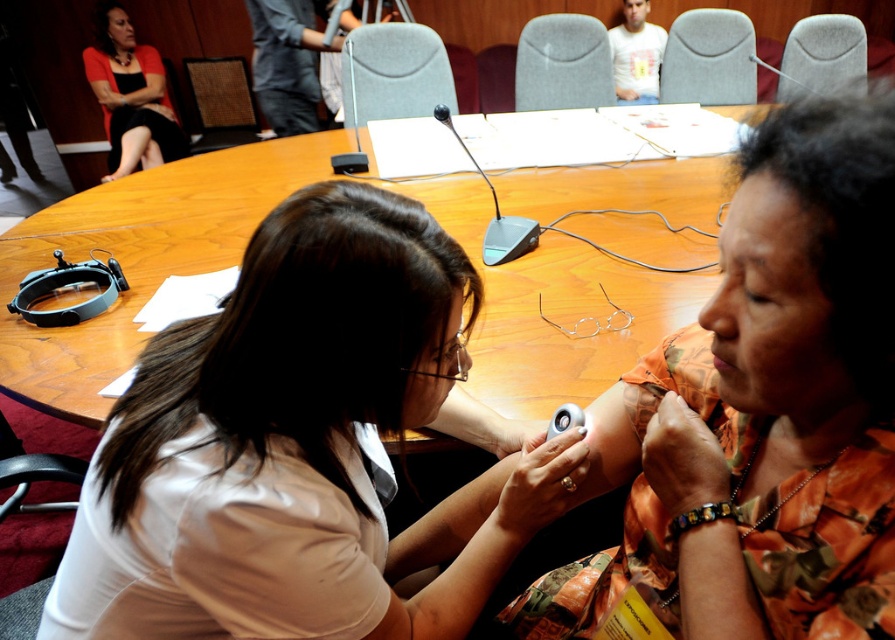
Question: Estimate the real-world distances between objects in this image. Which object is closer to the wooden at center?

Choices:
 (A) orange floral shirt at center
 (B) white matte shirt at center
 (C) matte black dress at upper left

Answer: (B)

Question: Is white matte shirt at center above orange floral shirt at center?

Choices:
 (A) yes
 (B) no

Answer: (B)

Question: Where is wooden at center located in relation to matte black dress at upper left in the image?

Choices:
 (A) right
 (B) left

Answer: (A)

Question: Is orange floral shirt at center thinner than matte black dress at upper left?

Choices:
 (A) yes
 (B) no

Answer: (A)

Question: Which of the following is the closest to the observer?

Choices:
 (A) wooden at center
 (B) matte black dress at upper left
 (C) white matte shirt at center

Answer: (C)

Question: Which point is farther to the camera?

Choices:
 (A) (103, 83)
 (B) (399, 221)

Answer: (A)